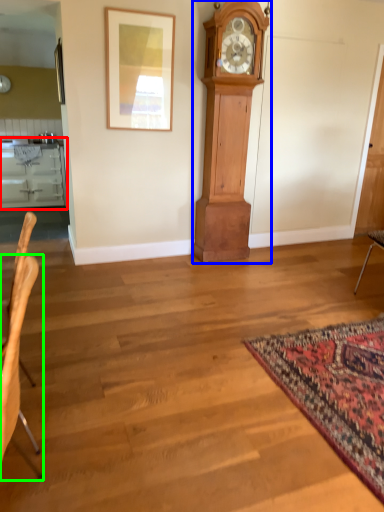
Question: Based on their relative distances, which object is nearer to cabinetry (highlighted by a red box)? Choose from wall clock (highlighted by a blue box) and chair (highlighted by a green box).

Choices:
 (A) wall clock
 (B) chair

Answer: (A)